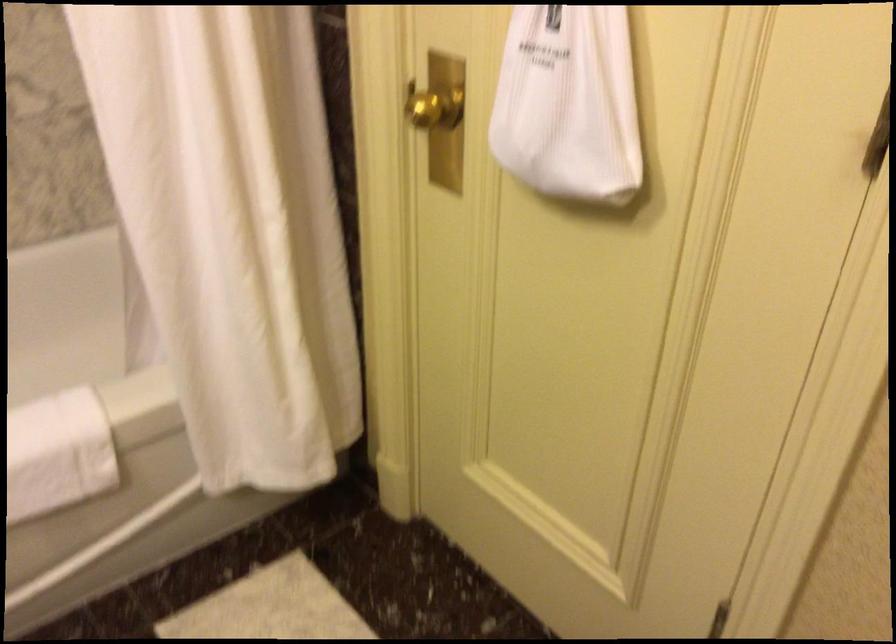
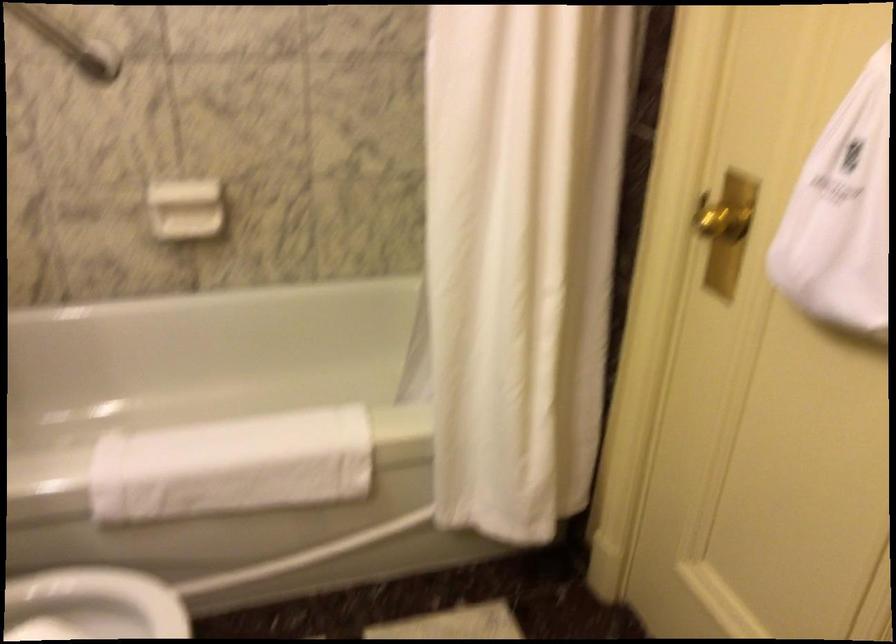
Question: Which direction would the cameraman need to move to produce the second image? Reply with the corresponding letter.

Choices:
 (A) Left
 (B) Right
 (C) Forward
 (D) Backward

Answer: (D)